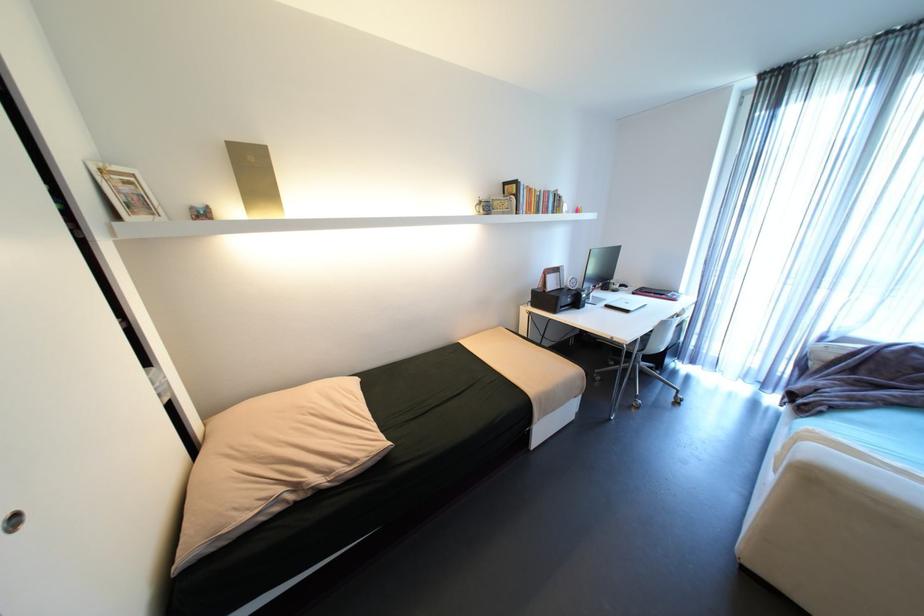
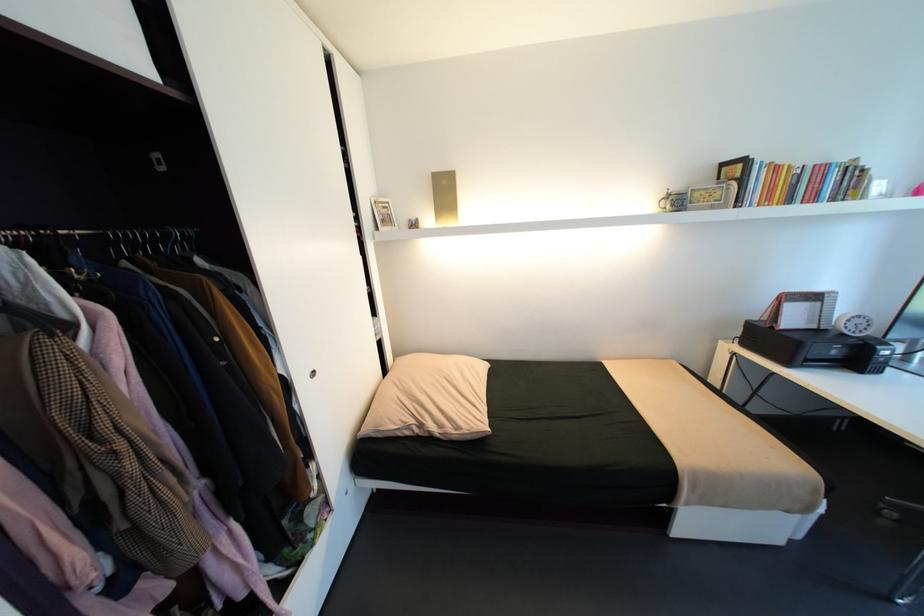
Find the pixel in the second image that matches point (577, 290) in the first image.

(850, 334)